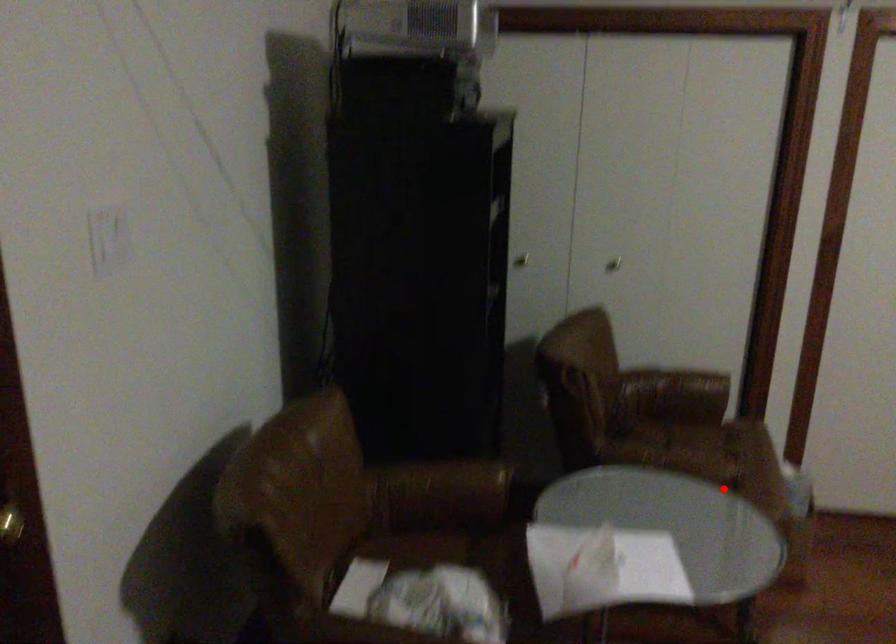
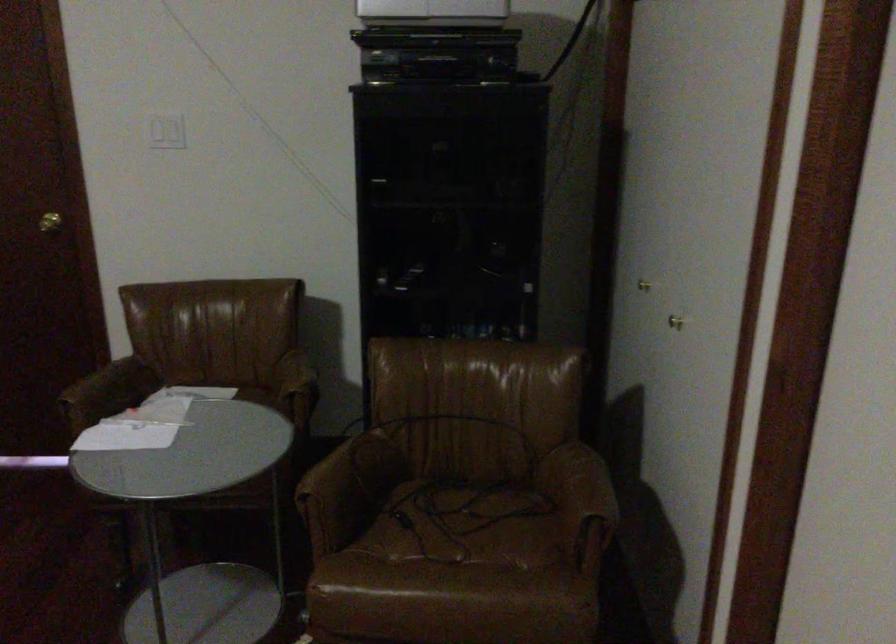
Where in the second image is the point corresponding to the highlighted location from the first image?

(312, 513)